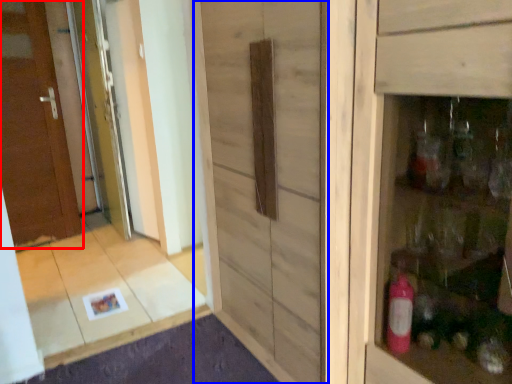
Question: Which point is closer to the camera, door (highlighted by a red box) or barn door (highlighted by a blue box)?

Choices:
 (A) door
 (B) barn door

Answer: (B)